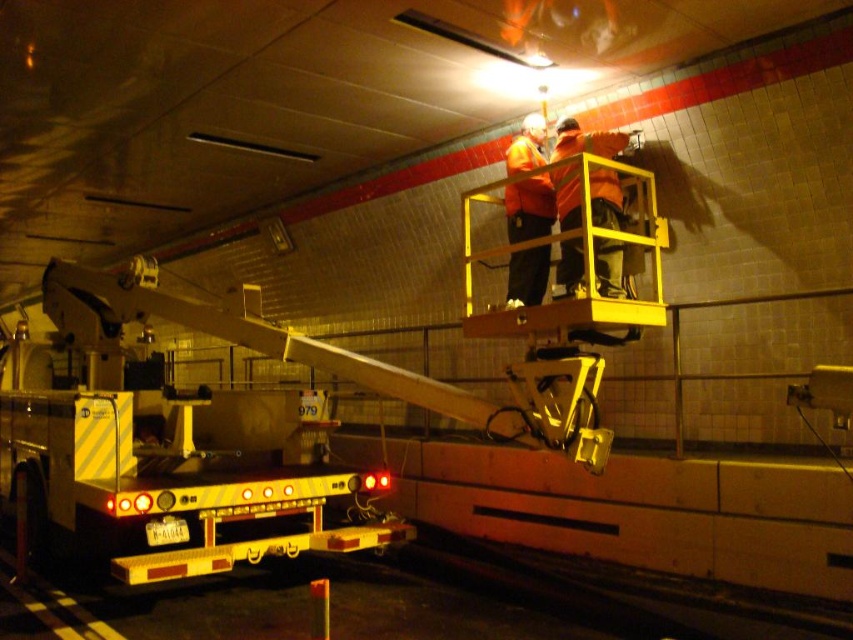
You are an inspector in the tunnel and see the orange reflective safety vest at center and the orange reflective jacket at center. Which one is positioned more to the right side?

The orange reflective safety vest at center is positioned more to the right side than the orange reflective jacket at center.